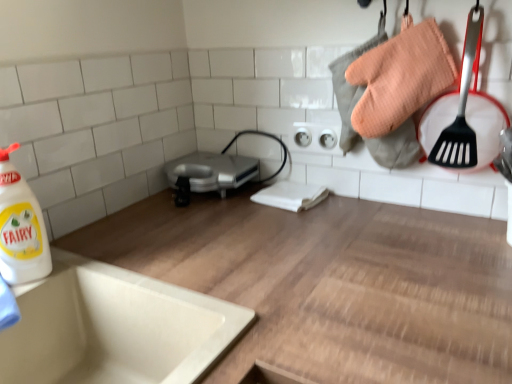
Question: Considering the relative sizes of silver metallic toaster at center and wooden at upper center in the image provided, is silver metallic toaster at center shorter than wooden at upper center?

Choices:
 (A) yes
 (B) no

Answer: (A)

Question: Does silver metallic toaster at center touch wooden at upper center?

Choices:
 (A) yes
 (B) no

Answer: (B)

Question: From a real-world perspective, is silver metallic toaster at center located beneath wooden at upper center?

Choices:
 (A) yes
 (B) no

Answer: (B)

Question: Considering the relative sizes of silver metallic toaster at center and wooden at upper center in the image provided, is silver metallic toaster at center wider than wooden at upper center?

Choices:
 (A) yes
 (B) no

Answer: (B)

Question: Is silver metallic toaster at center oriented away from wooden at upper center?

Choices:
 (A) no
 (B) yes

Answer: (A)

Question: Is white ceramic sink at lower left in front of or behind white glossy bottle at left in the image?

Choices:
 (A) behind
 (B) front

Answer: (B)

Question: Considering the positions of point 90,292 and point 5,266, is point 90,292 closer or farther from the camera than point 5,266?

Choices:
 (A) farther
 (B) closer

Answer: (A)

Question: Based on their sizes in the image, would you say white ceramic sink at lower left is bigger or smaller than white glossy bottle at left?

Choices:
 (A) small
 (B) big

Answer: (B)

Question: From the image's perspective, is white ceramic sink at lower left above or below white glossy bottle at left?

Choices:
 (A) below
 (B) above

Answer: (A)

Question: Is point (357, 284) positioned closer to the camera than point (218, 327)?

Choices:
 (A) farther
 (B) closer

Answer: (A)

Question: Considering the positions of wooden at upper center and white ceramic sink at lower left in the image, is wooden at upper center taller or shorter than white ceramic sink at lower left?

Choices:
 (A) short
 (B) tall

Answer: (B)

Question: Considering their positions, is wooden at upper center located in front of or behind white ceramic sink at lower left?

Choices:
 (A) front
 (B) behind

Answer: (A)

Question: In terms of width, does wooden at upper center look wider or thinner when compared to white ceramic sink at lower left?

Choices:
 (A) wide
 (B) thin

Answer: (A)

Question: Considering the relative positions of silver metallic toaster at center and white glossy bottle at left in the image provided, is silver metallic toaster at center to the left or to the right of white glossy bottle at left?

Choices:
 (A) left
 (B) right

Answer: (B)

Question: Based on their sizes in the image, would you say silver metallic toaster at center is bigger or smaller than white glossy bottle at left?

Choices:
 (A) small
 (B) big

Answer: (B)